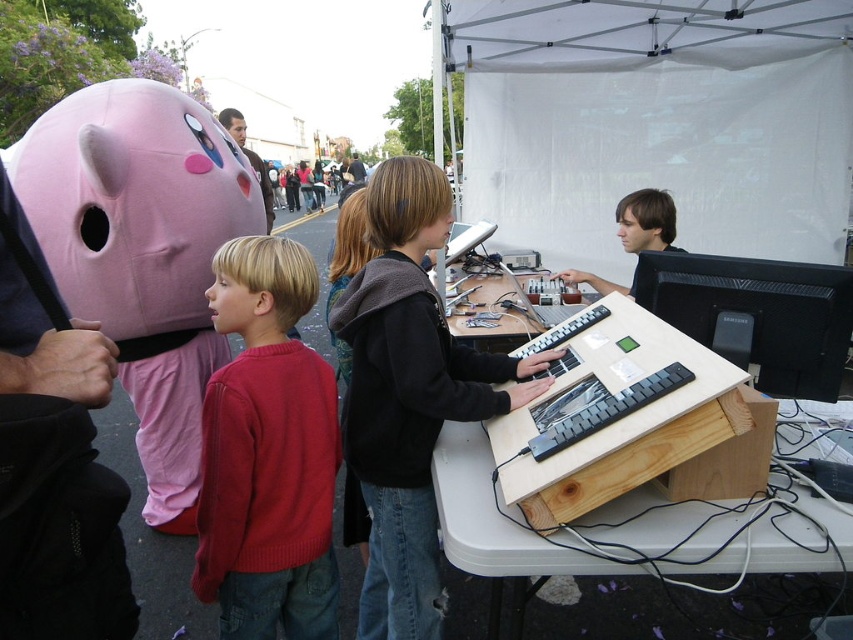
Question: Is knitted sweater at center thinner than black matte monitor at center?

Choices:
 (A) yes
 (B) no

Answer: (A)

Question: Is pink fabric mask at left behind matte black keyboard at center?

Choices:
 (A) no
 (B) yes

Answer: (A)

Question: From the image, what is the correct spatial relationship of black matte hoodie at center in relation to black matte monitor at center?

Choices:
 (A) right
 (B) left

Answer: (B)

Question: Which point is closer to the camera?

Choices:
 (A) (546, 433)
 (B) (109, 321)
 (C) (647, 259)

Answer: (A)

Question: Which point is farther from the camera taking this photo?

Choices:
 (A) (666, 369)
 (B) (514, 284)
 (C) (718, 289)
 (D) (807, 616)

Answer: (B)

Question: Which is nearer to the wooden at lower right?

Choices:
 (A) black plastic keyboard at center
 (B) knitted sweater at center

Answer: (A)